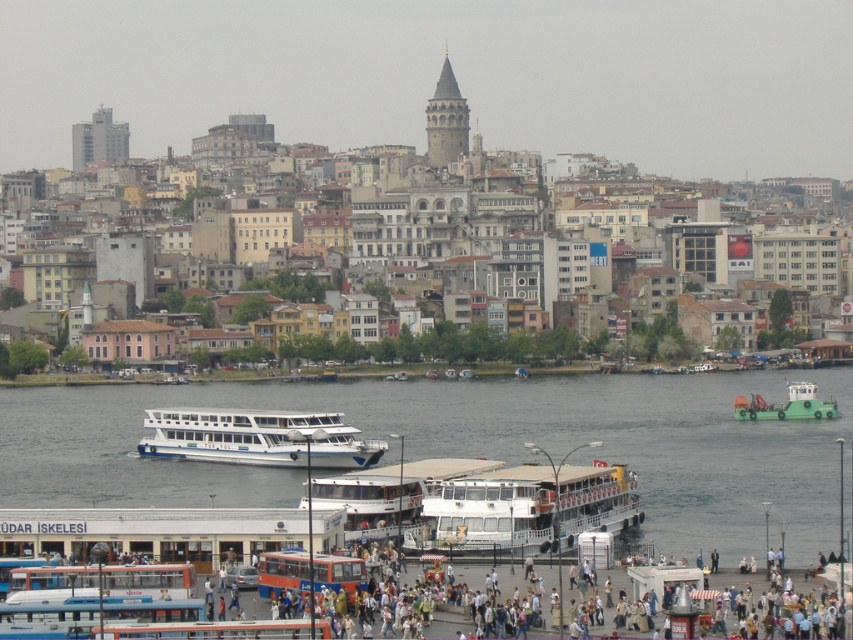
Who is taller, blue water at center or green matte tugboat at lower right?

blue water at center

Which is more to the left, blue water at center or green matte tugboat at lower right?

blue water at center is more to the left.

Does point (38, 496) lie in front of point (753, 396)?

That is True.

Find the location of `blue water at center`. blue water at center is located at coordinates (469, 445).

Between white matte boat at center and green matte tugboat at lower right, which one is positioned lower?

white matte boat at center

The image size is (853, 640). Find the location of `white matte boat at center`. white matte boat at center is located at coordinates (257, 436).

Who is higher up, blue water at center or white matte boat at center?

white matte boat at center is above.

Does blue water at center have a greater height compared to white matte boat at center?

Correct, blue water at center is much taller as white matte boat at center.

Between point (717, 416) and point (224, 416), which one is positioned in front?

Point (224, 416) is more forward.

This screenshot has height=640, width=853. I want to click on blue water at center, so click(x=469, y=445).